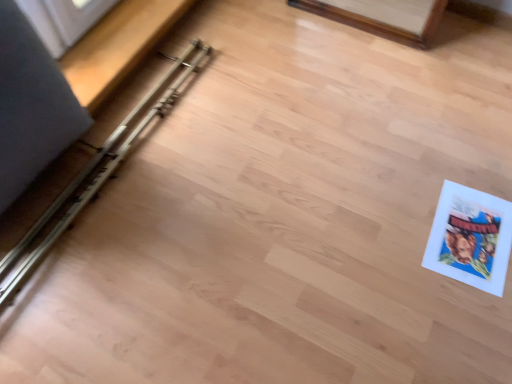
The width and height of the screenshot is (512, 384). Identify the location of free spot above white paper comic book at lower right (from a real-world perspective). (471, 225).